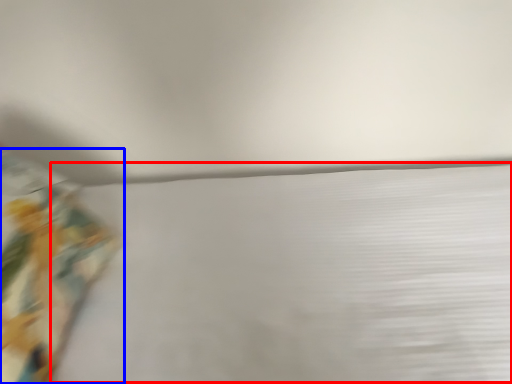
Question: Which point is further to the camera, sheet (highlighted by a red box) or curtain (highlighted by a blue box)?

Choices:
 (A) sheet
 (B) curtain

Answer: (B)